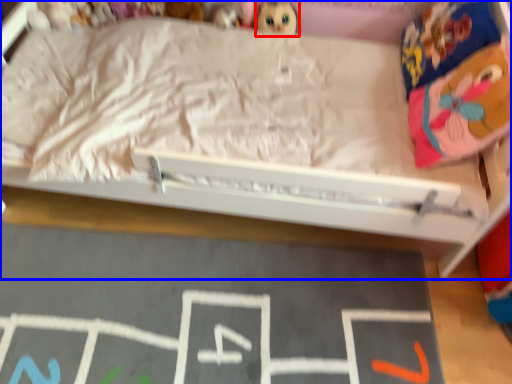
Question: Which object appears closest to the camera in this image, toy (highlighted by a red box) or bed (highlighted by a blue box)?

Choices:
 (A) toy
 (B) bed

Answer: (B)